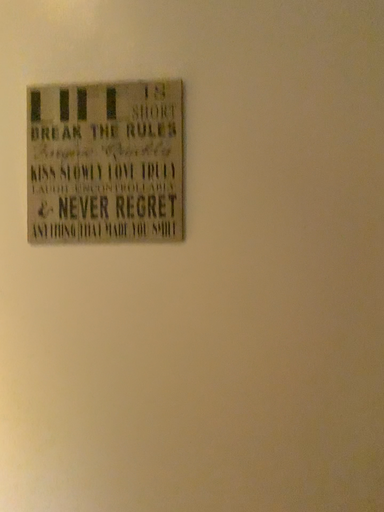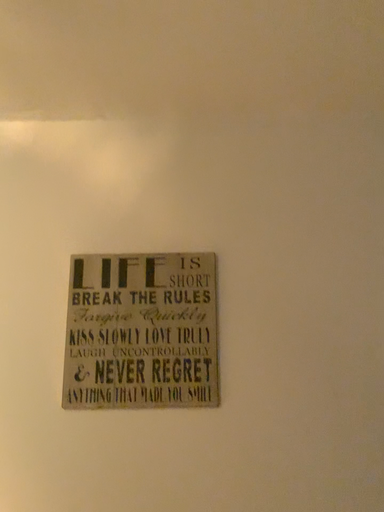
Question: How did the camera likely rotate when shooting the video?

Choices:
 (A) rotated upward
 (B) rotated downward

Answer: (A)